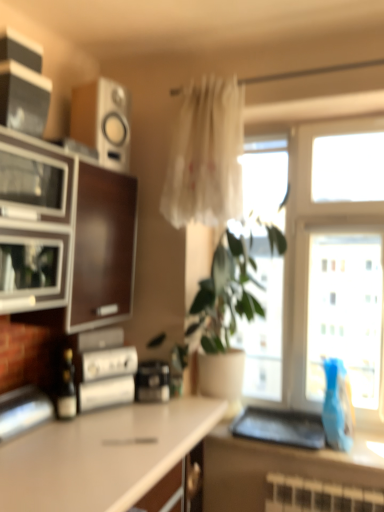
At what (x,y) coordinates should I click in order to perform the action: click on vacant space situated above transparent glass window at center (from a real-world perspective). Please return your answer as a coordinate pair (x, y). Looking at the image, I should click on (305, 120).